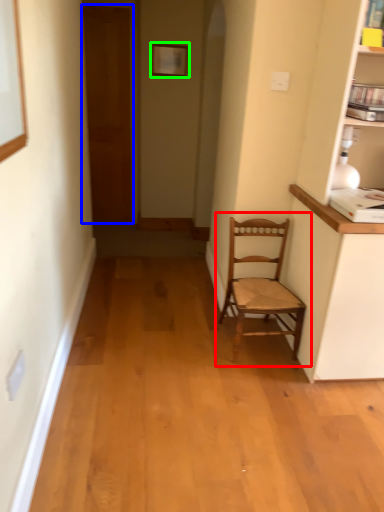
Question: Estimate the real-world distances between objects in this image. Which object is closer to chair (highlighted by a red box), door (highlighted by a blue box) or picture frame (highlighted by a green box)?

Choices:
 (A) door
 (B) picture frame

Answer: (B)